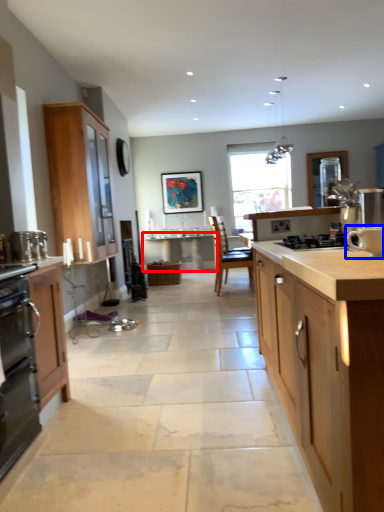
Question: Which object is closer to the camera taking this photo, table (highlighted by a red box) or appliance (highlighted by a blue box)?

Choices:
 (A) table
 (B) appliance

Answer: (B)